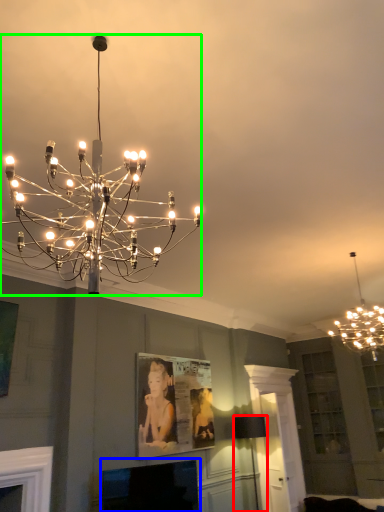
Question: Which object is positioned farthest from lamp (highlighted by a red box)? Select from fireplace (highlighted by a blue box) and lamp (highlighted by a green box).

Choices:
 (A) fireplace
 (B) lamp

Answer: (B)